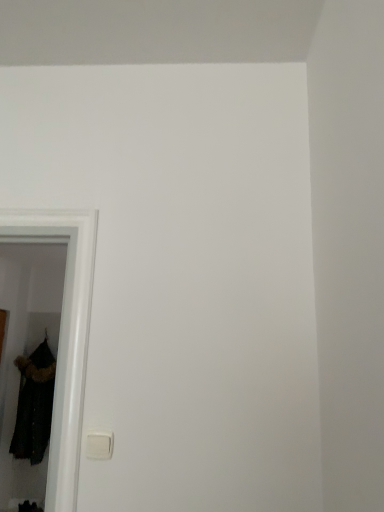
Find the location of a particular element. The height and width of the screenshot is (512, 384). velvet black coat at left is located at coordinates click(x=34, y=404).

In order to face velvet black coat at left, should I rotate leftwards or rightwards?

You should rotate left by 19.866 degrees.

This screenshot has width=384, height=512. What do you see at coordinates (34, 404) in the screenshot? I see `velvet black coat at left` at bounding box center [34, 404].

Identify the location of white plastic light switch at lower left. The image size is (384, 512). (99, 446).

This screenshot has width=384, height=512. What do you see at coordinates (99, 446) in the screenshot?
I see `white plastic light switch at lower left` at bounding box center [99, 446].

What is the approximate width of white plastic light switch at lower left?

white plastic light switch at lower left is 2.15 centimeters in width.

Identify the location of velvet black coat at left. The width and height of the screenshot is (384, 512). (34, 404).

Considering the positions of objects velvet black coat at left and white plastic light switch at lower left in the image provided, who is more to the right, velvet black coat at left or white plastic light switch at lower left?

From the viewer's perspective, white plastic light switch at lower left appears more on the right side.

Is the position of velvet black coat at left less distant than that of white plastic light switch at lower left?

No, velvet black coat at left is further to the viewer.

Is point (41, 389) farther from camera compared to point (110, 448)?

That is True.

From the image's perspective, relative to white plastic light switch at lower left, is velvet black coat at left above or below?

Based on their image positions, velvet black coat at left is located beneath white plastic light switch at lower left.

From a real-world perspective, is velvet black coat at left beneath white plastic light switch at lower left?

Correct, in the physical world, velvet black coat at left is lower than white plastic light switch at lower left.

Between velvet black coat at left and white plastic light switch at lower left, which one has larger width?

With larger width is velvet black coat at left.

Does velvet black coat at left have a lesser height compared to white plastic light switch at lower left?

In fact, velvet black coat at left may be taller than white plastic light switch at lower left.

Considering the sizes of objects velvet black coat at left and white plastic light switch at lower left in the image provided, who is bigger, velvet black coat at left or white plastic light switch at lower left?

velvet black coat at left is bigger.

Is velvet black coat at left located outside white plastic light switch at lower left?

Yes, velvet black coat at left is outside of white plastic light switch at lower left.

Is velvet black coat at left with white plastic light switch at lower left?

No, velvet black coat at left is not with white plastic light switch at lower left.

Is velvet black coat at left turned away from white plastic light switch at lower left?

No, velvet black coat at left is not facing away from white plastic light switch at lower left.

How many degrees apart are the facing directions of velvet black coat at left and white plastic light switch at lower left?

The angular difference between velvet black coat at left and white plastic light switch at lower left is 0.476 degrees.

Find the location of a particular element. The image size is (384, 512). light switch on the right side of velvet black coat at left is located at coordinates (99, 446).

Visually, is white plastic light switch at lower left positioned to the left or to the right of velvet black coat at left?

From the image, it's evident that white plastic light switch at lower left is to the right of velvet black coat at left.

Does white plastic light switch at lower left lie in front of velvet black coat at left?

Yes, white plastic light switch at lower left is closer to the viewer.

Does point (100, 449) lie in front of point (29, 445)?

That is True.

Consider the image. From the image's perspective, between white plastic light switch at lower left and velvet black coat at left, which one is located above?

From the image's view, white plastic light switch at lower left is above.

From a real-world perspective, is white plastic light switch at lower left physically above velvet black coat at left?

Indeed, from a real-world perspective, white plastic light switch at lower left stands above velvet black coat at left.

Does white plastic light switch at lower left have a greater width compared to velvet black coat at left?

In fact, white plastic light switch at lower left might be narrower than velvet black coat at left.

Can you confirm if white plastic light switch at lower left is shorter than velvet black coat at left?

Yes.

Does white plastic light switch at lower left have a smaller size compared to velvet black coat at left?

Yes, white plastic light switch at lower left is smaller than velvet black coat at left.

Would you say velvet black coat at left is part of white plastic light switch at lower left's contents?

That's incorrect, velvet black coat at left is not inside white plastic light switch at lower left.

Is the surface of white plastic light switch at lower left in direct contact with velvet black coat at left?

No.

In the scene shown: Is white plastic light switch at lower left positioned with its back to velvet black coat at left?

Yes, white plastic light switch at lower left's orientation is away from velvet black coat at left.

Can you tell me how much white plastic light switch at lower left and velvet black coat at left differ in facing direction?

The facing directions of white plastic light switch at lower left and velvet black coat at left are 0.476 degrees apart.

There is a velvet black coat at left. Identify the location of light switch above it (from a real-world perspective). This screenshot has width=384, height=512. (99, 446).

There is a velvet black coat at left. What are the coordinates of `light switch above it (from a real-world perspective)` in the screenshot? It's located at (99, 446).

In order to click on clothing beneath the white plastic light switch at lower left (from a real-world perspective) in this screenshot , I will do `click(34, 404)`.